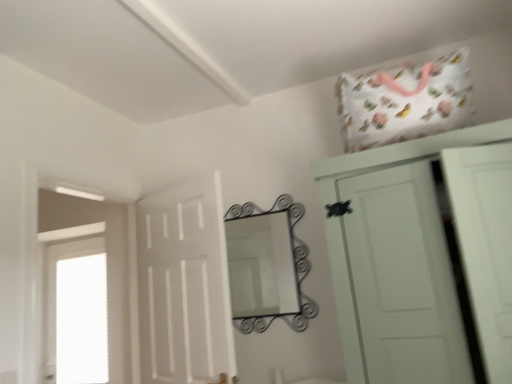
Question: From their relative heights in the image, would you say white matte cupboard at upper right is taller or shorter than transparent glass window at left?

Choices:
 (A) tall
 (B) short

Answer: (B)

Question: In terms of width, does white matte cupboard at upper right look wider or thinner when compared to transparent glass window at left?

Choices:
 (A) wide
 (B) thin

Answer: (A)

Question: Which object is the closest to the transparent glass window at left?

Choices:
 (A) metallic wrought iron mirror at center
 (B) white matte cupboard at upper right
 (C) white matte door at center

Answer: (C)

Question: Which of these objects is positioned farthest from the white matte cupboard at upper right?

Choices:
 (A) transparent glass window at left
 (B) metallic wrought iron mirror at center
 (C) white matte door at center

Answer: (A)